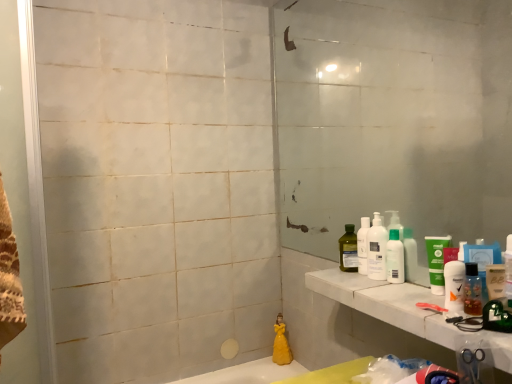
Question: Is white plastic bottles at right, acting as the second cleaning product starting from the bottom, thinner than clear glass screen door at left?

Choices:
 (A) yes
 (B) no

Answer: (A)

Question: Is white plastic bottles at right, which ranks as the first cleaning product in right-to-left order, next to clear glass screen door at left?

Choices:
 (A) yes
 (B) no

Answer: (B)

Question: From the image's perspective, is white plastic bottles at right, the 1th cleaning product positioned from the top, below clear glass screen door at left?

Choices:
 (A) no
 (B) yes

Answer: (B)

Question: Is white plastic bottles at right, the first cleaning product from the front, oriented away from clear glass screen door at left?

Choices:
 (A) yes
 (B) no

Answer: (B)

Question: Is white plastic bottles at right, which ranks as the first cleaning product in right-to-left order, shorter than clear glass screen door at left?

Choices:
 (A) no
 (B) yes

Answer: (B)

Question: Considering the relative positions of white marble counter top at right and translucent plastic bottle at right, the 1th mouthwash viewed from the front, in the image provided, is white marble counter top at right to the left or to the right of translucent plastic bottle at right, the 1th mouthwash viewed from the front,?

Choices:
 (A) right
 (B) left

Answer: (B)

Question: From the image's perspective, is white marble counter top at right located above or below translucent plastic bottle at right, the 1th mouthwash viewed from the front?

Choices:
 (A) above
 (B) below

Answer: (B)

Question: Does point (357, 307) appear closer or farther from the camera than point (474, 286)?

Choices:
 (A) closer
 (B) farther

Answer: (B)

Question: Choose the correct answer: Is white marble counter top at right inside translucent plastic bottle at right, the 1th mouthwash viewed from the front, or outside it?

Choices:
 (A) outside
 (B) inside

Answer: (A)

Question: Based on their positions, is white marble counter top at right located to the left or right of clear glass screen door at left?

Choices:
 (A) right
 (B) left

Answer: (A)

Question: Does point (324, 288) appear closer or farther from the camera than point (24, 18)?

Choices:
 (A) closer
 (B) farther

Answer: (B)

Question: Considering the positions of white marble counter top at right and clear glass screen door at left in the image, is white marble counter top at right taller or shorter than clear glass screen door at left?

Choices:
 (A) tall
 (B) short

Answer: (B)

Question: From a real-world perspective, is white marble counter top at right above or below clear glass screen door at left?

Choices:
 (A) above
 (B) below

Answer: (B)

Question: Is white plastic bottles at right, the first cleaning product from the front, taller or shorter than white plastic bottles at right?

Choices:
 (A) short
 (B) tall

Answer: (B)

Question: Is white plastic bottles at right, acting as the second cleaning product starting from the bottom, inside the boundaries of white plastic bottles at right, or outside?

Choices:
 (A) outside
 (B) inside

Answer: (A)